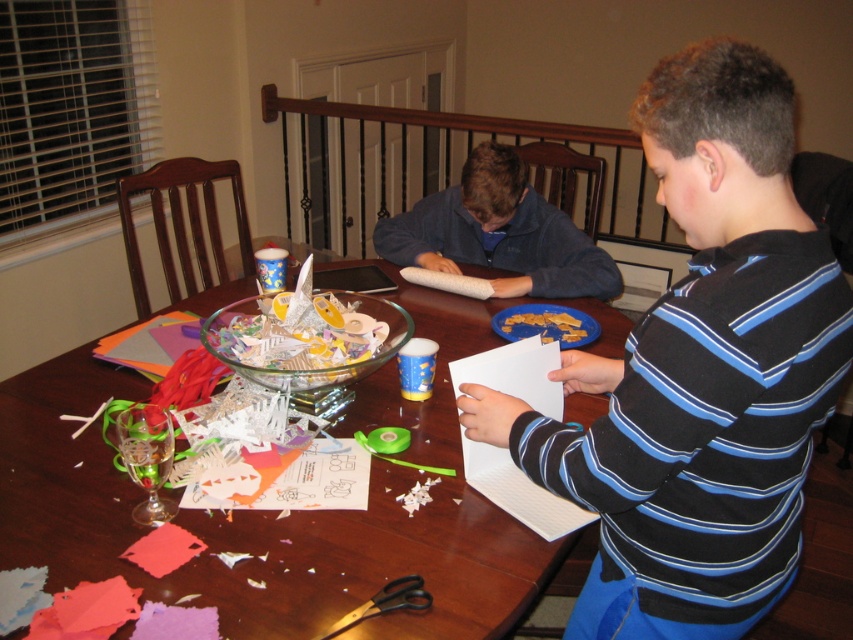
You are trying to place a new decorative item on the table. The item is 10 cm thick. Can you place it on the wooden table at center without overlapping the blue striped shirt at center?

The blue striped shirt at center is thinner than the wooden table at center, but the description does not provide specific measurements for the shirt or table. Therefore, it is uncertain whether the 10 cm thick item can be placed without overlapping. More information about the dimensions of the shirt and table is needed.

You are a delivery robot that needs to place a small package between the blue striped shirt at center and the blue fleece sweater at center. The package is 0.5 meters long. Can you fit it between them without moving either item?

The blue striped shirt at center and blue fleece sweater at center are 1.04 meters apart from each other. Since the package is 0.5 meters long, there is enough space between them to place the package without moving either item.